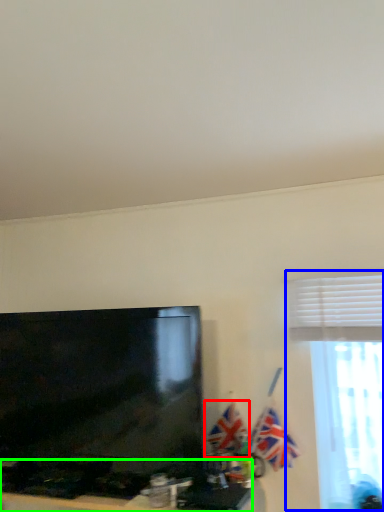
Question: Considering the real-world distances, which object is farthest from flag (highlighted by a red box)? window (highlighted by a blue box) or furniture (highlighted by a green box)?

Choices:
 (A) window
 (B) furniture

Answer: (A)